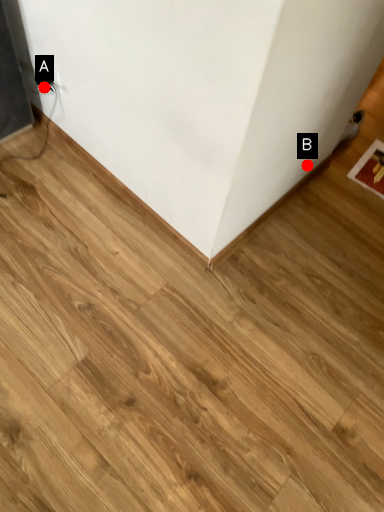
Question: Two points are circled on the image, labeled by A and B beside each circle. Which point is closer to the camera?

Choices:
 (A) A is closer
 (B) B is closer

Answer: (A)